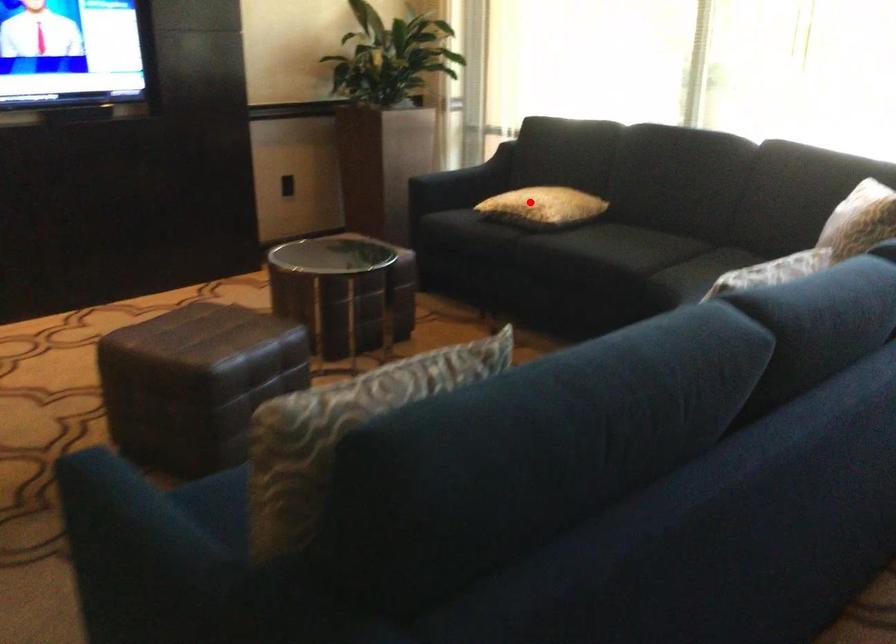
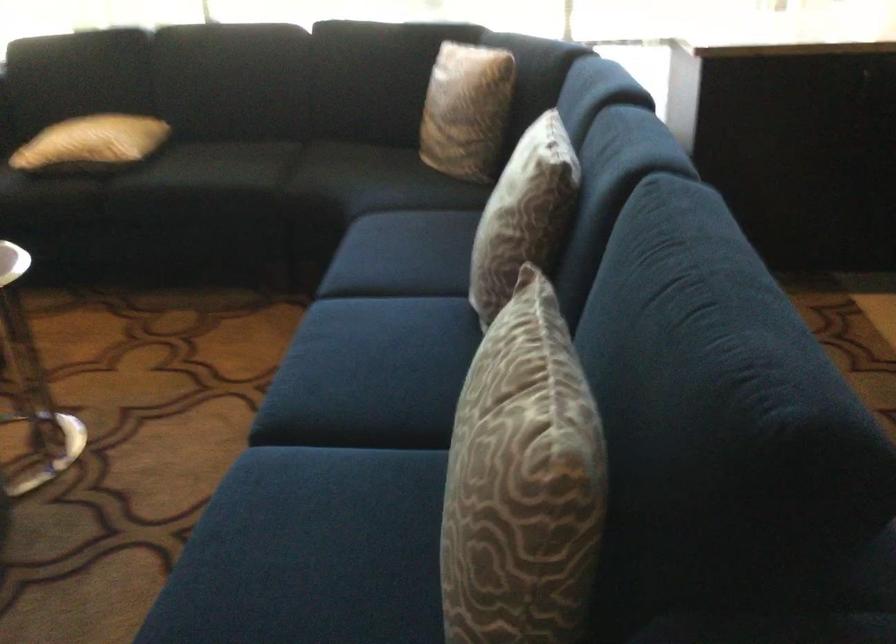
In the second image, find the point that corresponds to the highlighted location in the first image.

(91, 142)